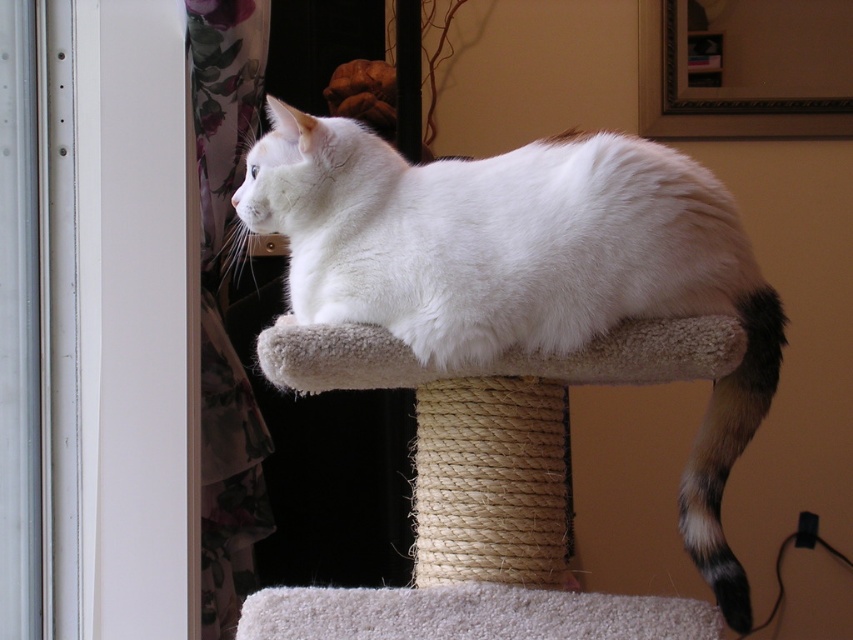
Question: Which of the following is the closest to the observer?

Choices:
 (A) (252, 211)
 (B) (776, 326)

Answer: (B)

Question: Which object is farther from the camera taking this photo?

Choices:
 (A) white fluffy cat at center
 (B) black and white fur tail at right

Answer: (B)

Question: Can you confirm if white fluffy cat at center is positioned to the left of black and white fur tail at right?

Choices:
 (A) no
 (B) yes

Answer: (B)

Question: Is white fluffy cat at center smaller than black and white fur tail at right?

Choices:
 (A) yes
 (B) no

Answer: (B)

Question: Is white fluffy cat at center bigger than black and white fur tail at right?

Choices:
 (A) no
 (B) yes

Answer: (B)